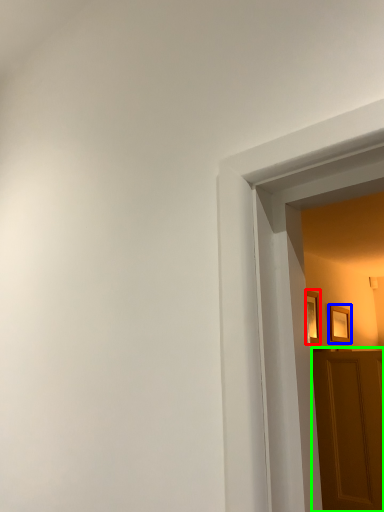
Question: Which object is the closest to the picture frame (highlighted by a red box)? Choose among these: picture frame (highlighted by a blue box) or door (highlighted by a green box).

Choices:
 (A) picture frame
 (B) door

Answer: (A)